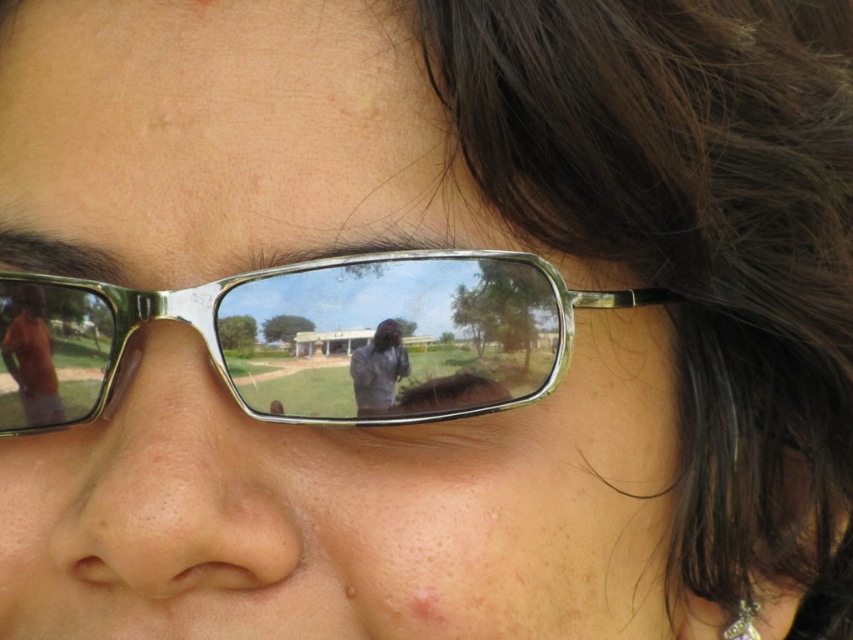
Can you confirm if matte black shirt at center is positioned to the left of pink matte freckle at lower center?

Yes, matte black shirt at center is to the left of pink matte freckle at lower center.

Locate an element on the screen. matte black shirt at center is located at coordinates (378, 369).

Find the location of `matte black shirt at center`. matte black shirt at center is located at coordinates (378, 369).

Is matte skin nose at center to the right of pink matte freckle at lower center from the viewer's perspective?

In fact, matte skin nose at center is to the left of pink matte freckle at lower center.

Is matte skin nose at center smaller than pink matte freckle at lower center?

Actually, matte skin nose at center might be larger than pink matte freckle at lower center.

Does point (107, 552) come in front of point (389, 600)?

Yes, point (107, 552) is closer to viewer.

Locate an element on the screen. This screenshot has height=640, width=853. matte skin nose at center is located at coordinates (170, 483).

Does metallic frame glasses at center appear on the left side of pink matte freckle at lower center?

Yes, metallic frame glasses at center is to the left of pink matte freckle at lower center.

The image size is (853, 640). Find the location of `metallic frame glasses at center`. metallic frame glasses at center is located at coordinates (306, 336).

Identify the location of metallic frame glasses at center. Image resolution: width=853 pixels, height=640 pixels. (306, 336).